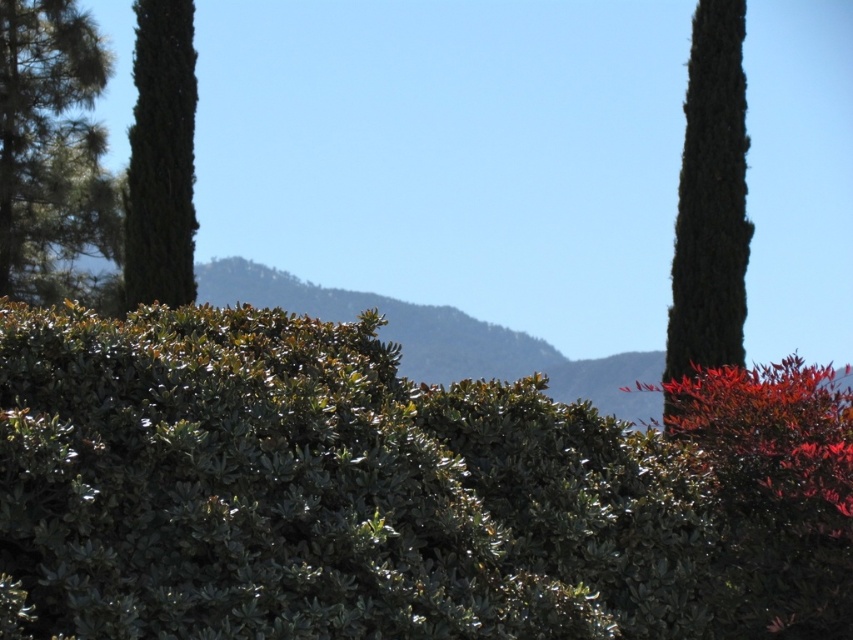
Which is more to the left, green rough bark tree at right or green textured tree at left?

green textured tree at left

Does green rough bark tree at right appear on the left side of green textured tree at left?

Incorrect, green rough bark tree at right is not on the left side of green textured tree at left.

Locate an element on the screen. green rough bark tree at right is located at coordinates (711, 204).

Does point (4, 225) come in front of point (178, 4)?

No, it is not.

Which of these two, green leafy tree at left or green textured tree at left, stands shorter?

green textured tree at left

The height and width of the screenshot is (640, 853). Describe the element at coordinates (51, 150) in the screenshot. I see `green leafy tree at left` at that location.

Find the location of a particular element. Image resolution: width=853 pixels, height=640 pixels. green leafy tree at left is located at coordinates (51, 150).

Does green leafy tree at left lie in front of green rough bark tree at right?

No, it is not.

Does green leafy tree at left have a larger size compared to green rough bark tree at right?

Correct, green leafy tree at left is larger in size than green rough bark tree at right.

Who is more forward, [90,76] or [689,214]?

Positioned in front is point [689,214].

Where is `green leafy tree at left`? The image size is (853, 640). green leafy tree at left is located at coordinates (51, 150).